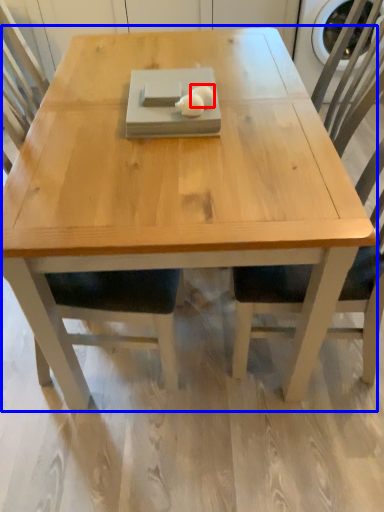
Question: Which of the following is the closest to the observer, food (highlighted by a red box) or coffee table (highlighted by a blue box)?

Choices:
 (A) food
 (B) coffee table

Answer: (A)